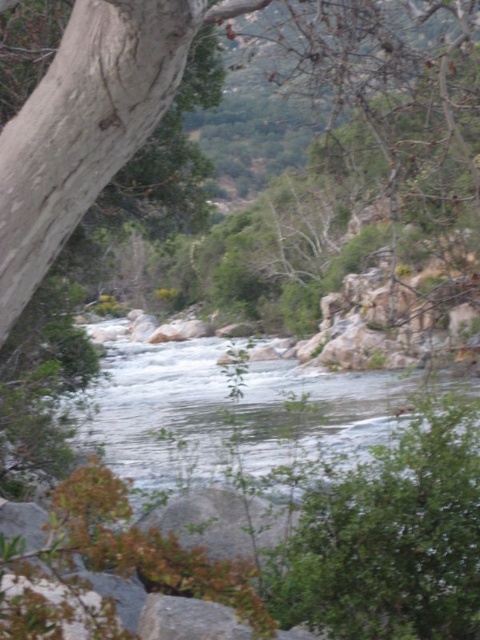
Can you confirm if clear water at center is shorter than gray rough rock at center?

In fact, clear water at center may be taller than gray rough rock at center.

Can you confirm if clear water at center is wider than gray rough rock at center?

Yes, clear water at center is wider than gray rough rock at center.

Is point (367, 381) closer to camera compared to point (224, 547)?

No.

In order to click on clear water at center in this screenshot , I will do `click(233, 412)`.